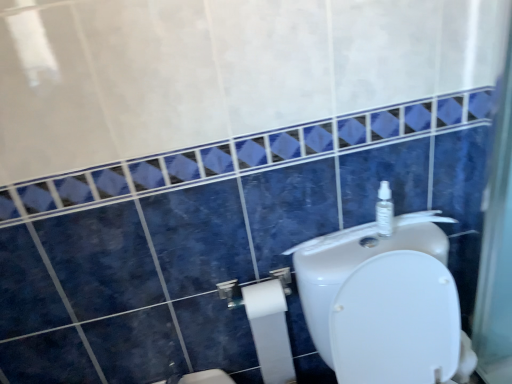
Measure the distance between white matte toilet paper at lower center and camera.

white matte toilet paper at lower center is 3.63 feet away from camera.

In order to face clear plastic spray bottle at upper right, should I rotate leftwards or rightwards?

You should look right and rotate roughly 16.903 degrees.

At what (x,y) coordinates should I click in order to perform the action: click on clear plastic spray bottle at upper right. Please return your answer as a coordinate pair (x, y). Looking at the image, I should click on (384, 210).

Find the location of a particular element. Image resolution: width=512 pixels, height=384 pixels. white matte toilet paper at lower center is located at coordinates (250, 285).

From a real-world perspective, is white matte toilet paper at lower center physically above white glossy toilet at upper right?

Yes, from a real-world perspective, white matte toilet paper at lower center is above white glossy toilet at upper right.

In terms of size, does white matte toilet paper at lower center appear bigger or smaller than white glossy toilet at upper right?

white matte toilet paper at lower center is smaller than white glossy toilet at upper right.

Can you confirm if white matte toilet paper at lower center is positioned to the right of white glossy toilet at upper right?

No.

Based on the photo, would you say white matte toilet paper at lower center contains white glossy toilet at upper right?

No, white glossy toilet at upper right is located outside of white matte toilet paper at lower center.

Where is `toilet paper that is below the clear plastic spray bottle at upper right (from the image's perspective)`? This screenshot has width=512, height=384. toilet paper that is below the clear plastic spray bottle at upper right (from the image's perspective) is located at coordinates (270, 330).

Is white matte toilet paper at lower center closer to camera compared to clear plastic spray bottle at upper right?

No, white matte toilet paper at lower center is further to the viewer.

Is white matte toilet paper at lower center not inside clear plastic spray bottle at upper right?

Yes.

In the scene shown: From a real-world perspective, is white matte toilet paper at lower center on top of clear plastic spray bottle at upper right?

No.

Does white glossy toilet at upper right touch white matte toilet paper at lower center?

There is a gap between white glossy toilet at upper right and white matte toilet paper at lower center.

From a real-world perspective, is white glossy toilet at upper right above or below white matte toilet paper at lower center?

In terms of real-world spatial position, white glossy toilet at upper right is below white matte toilet paper at lower center.

Is white glossy toilet at upper right inside the boundaries of white matte toilet paper at lower center, or outside?

The correct answer is: outside.

Is white glossy toilet at upper right closer to camera compared to white matte toilet paper at lower center?

Yes, the depth of white glossy toilet at upper right is less than that of white matte toilet paper at lower center.

Is white matte toilet paper at lower center completely or partially inside white matte toilet paper at lower center?

Actually, white matte toilet paper at lower center is outside white matte toilet paper at lower center.

Does white matte toilet paper at lower center have a lesser height compared to white matte toilet paper at lower center?

Yes, white matte toilet paper at lower center is shorter than white matte toilet paper at lower center.

From the image's perspective, is white matte toilet paper at lower center located above or below white matte toilet paper at lower center?

Based on their image positions, white matte toilet paper at lower center is located above white matte toilet paper at lower center.

Consider the image. Between white matte toilet paper at lower center and white glossy toilet at upper right, which one has smaller size?

white matte toilet paper at lower center.

In terms of height, does white matte toilet paper at lower center look taller or shorter compared to white glossy toilet at upper right?

white matte toilet paper at lower center is shorter than white glossy toilet at upper right.

Is white matte toilet paper at lower center positioned far away from white glossy toilet at upper right?

They are positioned close to each other.

Is white matte toilet paper at lower center turned away from white glossy toilet at upper right?

No, white glossy toilet at upper right is not at the back of white matte toilet paper at lower center.

From a real-world perspective, is white matte toilet paper at lower center under white matte toilet paper at lower center?

Yes.

Would you say white matte toilet paper at lower center is to the left or to the right of white matte toilet paper at lower center in the picture?

white matte toilet paper at lower center is positioned on white matte toilet paper at lower center's right side.

Between white matte toilet paper at lower center and white matte toilet paper at lower center, which one is positioned in front?

Positioned in front is white matte toilet paper at lower center.

Can you confirm if white matte toilet paper at lower center is bigger than white matte toilet paper at lower center?

Yes, white matte toilet paper at lower center is bigger than white matte toilet paper at lower center.

From a real-world perspective, does white matte toilet paper at lower center sit lower than clear plastic spray bottle at upper right?

Indeed, from a real-world perspective, white matte toilet paper at lower center is positioned beneath clear plastic spray bottle at upper right.

Is clear plastic spray bottle at upper right at the back of white matte toilet paper at lower center?

Result: No, white matte toilet paper at lower center's orientation is not away from clear plastic spray bottle at upper right.

From the image's perspective, does white matte toilet paper at lower center appear lower than clear plastic spray bottle at upper right?

Yes, from the image's perspective, white matte toilet paper at lower center is below clear plastic spray bottle at upper right.

Is clear plastic spray bottle at upper right completely or partially inside white matte toilet paper at lower center?

No, clear plastic spray bottle at upper right is not surrounded by white matte toilet paper at lower center.

Find the location of `toilet paper above the white glossy toilet at upper right (from a real-world perspective)`. toilet paper above the white glossy toilet at upper right (from a real-world perspective) is located at coordinates (270, 330).

Find the location of `soap dispenser that appears above the white matte toilet paper at lower center (from the image's perspective)`. soap dispenser that appears above the white matte toilet paper at lower center (from the image's perspective) is located at coordinates (384, 210).

Looking at the image, which one is located closer to clear plastic spray bottle at upper right, white matte toilet paper at lower center or white matte toilet paper at lower center?

Among the two, white matte toilet paper at lower center is located nearer to clear plastic spray bottle at upper right.

Looking at the image, which one is located further to white glossy toilet at upper right, clear plastic spray bottle at upper right or white matte toilet paper at lower center?

The object further to white glossy toilet at upper right is white matte toilet paper at lower center.

From the picture: Estimate the real-world distances between objects in this image. Which object is further from white matte toilet paper at lower center, white glossy toilet at upper right or white matte toilet paper at lower center?

white glossy toilet at upper right is positioned further to the anchor white matte toilet paper at lower center.

Based on their spatial positions, is white matte toilet paper at lower center or white glossy toilet at upper right closer to white matte toilet paper at lower center?

white matte toilet paper at lower center is positioned closer to the anchor white matte toilet paper at lower center.

Which object lies further to the anchor point white matte toilet paper at lower center, white glossy toilet at upper right or clear plastic spray bottle at upper right?

Among the two, clear plastic spray bottle at upper right is located further to white matte toilet paper at lower center.

Considering their positions, is white matte toilet paper at lower center positioned further to clear plastic spray bottle at upper right than white matte toilet paper at lower center?

The object further to clear plastic spray bottle at upper right is white matte toilet paper at lower center.

Which object lies nearer to the anchor point clear plastic spray bottle at upper right, white matte toilet paper at lower center or white glossy toilet at upper right?

The object closer to clear plastic spray bottle at upper right is white glossy toilet at upper right.

Based on their spatial positions, is clear plastic spray bottle at upper right or white glossy toilet at upper right further from white matte toilet paper at lower center?

clear plastic spray bottle at upper right lies further to white matte toilet paper at lower center than the other object.

Locate an element on the screen. toilet paper located between white glossy toilet at upper right and white matte toilet paper at lower center in the depth direction is located at coordinates (270, 330).

In order to click on toilet paper between clear plastic spray bottle at upper right and white glossy toilet at upper right in the vertical direction in this screenshot , I will do `click(270, 330)`.

You are a GUI agent. You are given a task and a screenshot of the screen. Output one action in this format:
    pyautogui.click(x=<x>, y=<y>)
    Task: Click on the soap dispenser located between white glossy toilet at upper right and white matte toilet paper at lower center in the depth direction
    
    Given the screenshot: What is the action you would take?
    pyautogui.click(x=384, y=210)

You are a GUI agent. You are given a task and a screenshot of the screen. Output one action in this format:
    pyautogui.click(x=<x>, y=<y>)
    Task: Click on the shower between clear plastic spray bottle at upper right and white matte toilet paper at lower center vertically
    The height and width of the screenshot is (384, 512).
    Given the screenshot: What is the action you would take?
    pyautogui.click(x=250, y=285)